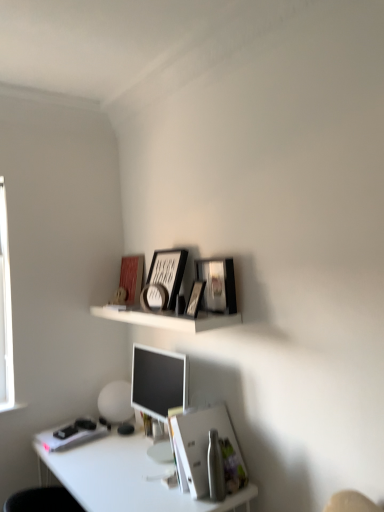
Identify the location of free location above white glossy desk at lower left (from a real-world perspective). (132, 457).